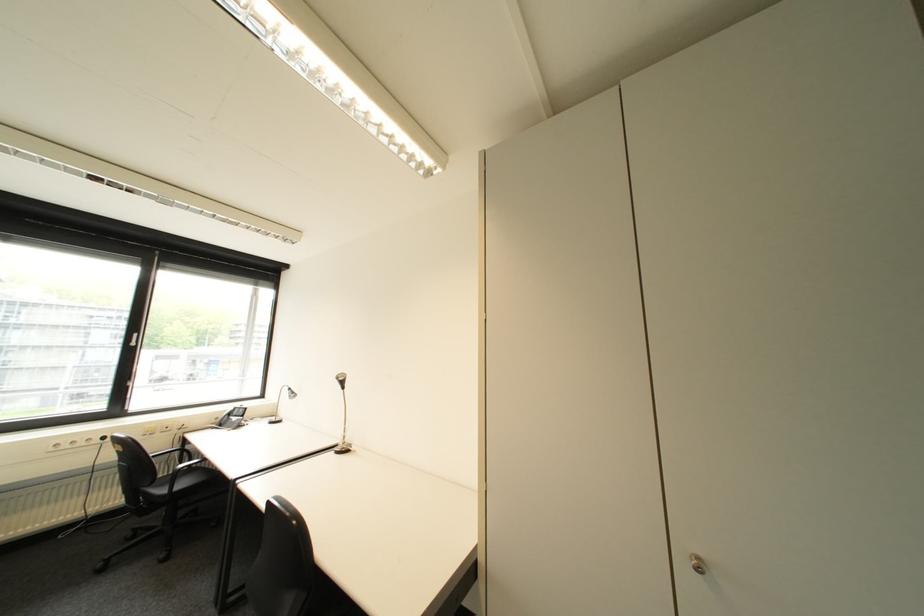
Locate an element on the screen. Image resolution: width=924 pixels, height=616 pixels. telephone handset is located at coordinates pos(225,415).